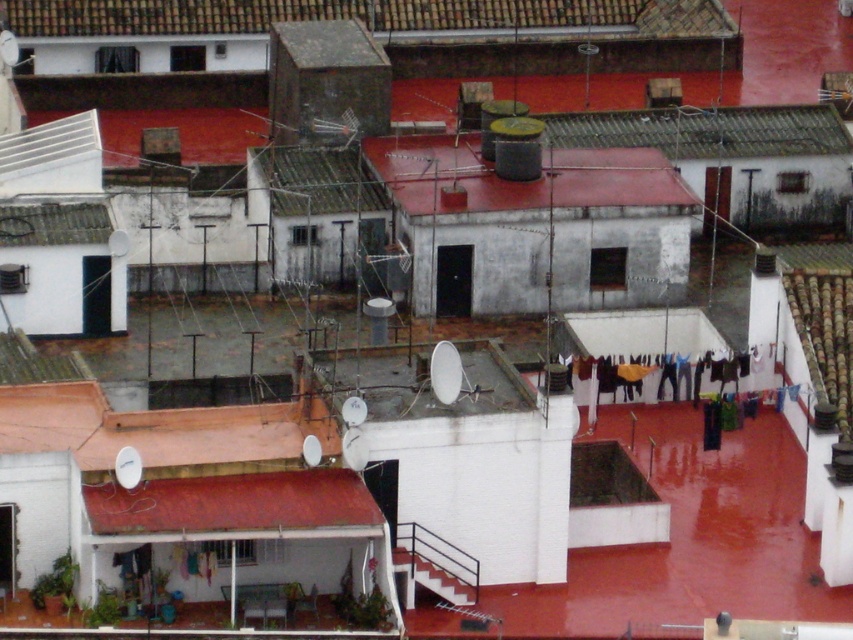
Does point (654, 188) come closer to viewer compared to point (376, 515)?

No, it is behind (376, 515).

Is red matte roof at center below smooth red awning at center?

No.

The image size is (853, 640). What are the coordinates of `red matte roof at center` in the screenshot? It's located at (521, 180).

Which is above, red matte roof at center or rusty corrugated metal roof at upper center?

rusty corrugated metal roof at upper center is above.

Which is more to the left, red matte roof at center or rusty corrugated metal roof at upper center?

red matte roof at center

Who is more distant from viewer, [624,160] or [752,125]?

The point [752,125] is more distant.

Image resolution: width=853 pixels, height=640 pixels. Find the location of `red matte roof at center`. red matte roof at center is located at coordinates (521, 180).

Is smooth red awning at center positioned in front of rusty corrugated metal roof at upper center?

Yes, smooth red awning at center is in front of rusty corrugated metal roof at upper center.

Is point (225, 525) farther from camera compared to point (581, 129)?

No, (225, 525) is closer to viewer.

Locate an element on the screen. Image resolution: width=853 pixels, height=640 pixels. smooth red awning at center is located at coordinates (233, 502).